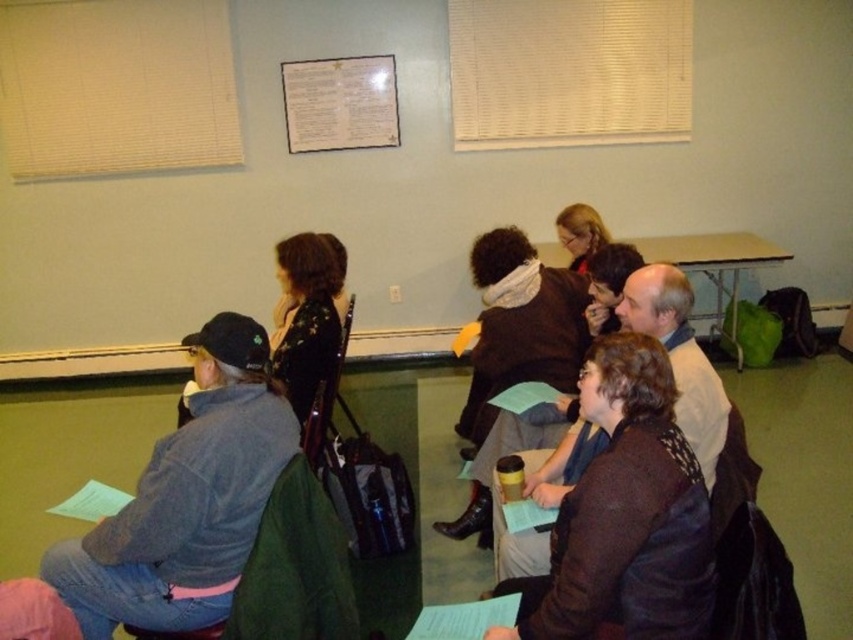
Question: Is floral-patterned fabric at center wider than matte black jacket at center?

Choices:
 (A) no
 (B) yes

Answer: (B)

Question: Can you confirm if brown fuzzy sweater at center is bigger than floral-patterned fabric at center?

Choices:
 (A) no
 (B) yes

Answer: (A)

Question: Which of the following is the closest to the observer?

Choices:
 (A) (593, 246)
 (B) (630, 342)

Answer: (B)

Question: Which of these objects is positioned closest to the matte black jacket at center?

Choices:
 (A) floral-patterned fabric at center
 (B) brown fuzzy sweater at center

Answer: (A)

Question: Is floral-patterned fabric at center to the right of matte black jacket at center from the viewer's perspective?

Choices:
 (A) yes
 (B) no

Answer: (B)

Question: Which object appears farthest from the camera in this image?

Choices:
 (A) floral-patterned fabric at center
 (B) brown fuzzy sweater at center
 (C) matte black jacket at center

Answer: (C)